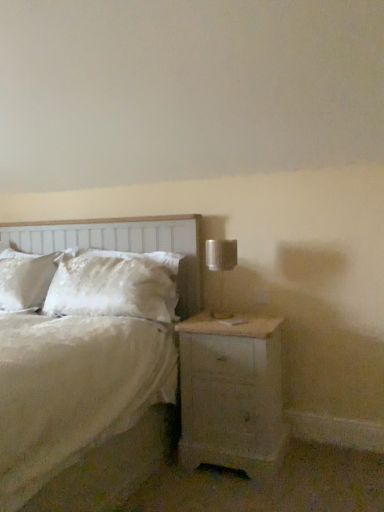
The image size is (384, 512). What do you see at coordinates (124, 243) in the screenshot? I see `white satin bed at center` at bounding box center [124, 243].

Looking at this image, measure the distance between metallic silver table lamp at right and camera.

The depth of metallic silver table lamp at right is 6.84 feet.

What is the approximate height of white wood headboard at left?

It is 84.37 centimeters.

Where is `white wood headboard at left`? white wood headboard at left is located at coordinates (124, 244).

Where is `white painted wood nightstand at lower right`? The height and width of the screenshot is (512, 384). white painted wood nightstand at lower right is located at coordinates (232, 394).

Can you tell me how much white painted wood nightstand at lower right and white satin bed at center differ in facing direction?

There is a 1.6-degree angle between the facing directions of white painted wood nightstand at lower right and white satin bed at center.

Does white painted wood nightstand at lower right turn towards white satin bed at center?

No, white painted wood nightstand at lower right is not oriented towards white satin bed at center.

Is white painted wood nightstand at lower right surrounding white satin bed at center?

No, white satin bed at center is not inside white painted wood nightstand at lower right.

From the image's perspective, which one is positioned higher, white painted wood nightstand at lower right or white satin bed at center?

white satin bed at center is shown above in the image.

Is white painted wood nightstand at lower right positioned before metallic silver table lamp at right?

Yes, it is in front of metallic silver table lamp at right.

In terms of width, does white painted wood nightstand at lower right look wider or thinner when compared to metallic silver table lamp at right?

white painted wood nightstand at lower right is wider than metallic silver table lamp at right.

Where is `table lamp that appears above the white painted wood nightstand at lower right (from the image's perspective)`? This screenshot has height=512, width=384. table lamp that appears above the white painted wood nightstand at lower right (from the image's perspective) is located at coordinates (221, 269).

Can you confirm if white painted wood nightstand at lower right is bigger than metallic silver table lamp at right?

Yes, white painted wood nightstand at lower right is bigger than metallic silver table lamp at right.

From the picture: Is white fluffy pillow at center next to white painted wood nightstand at lower right and touching it?

No, white fluffy pillow at center is not next to white painted wood nightstand at lower right.

Is white fluffy pillow at center positioned in front of white painted wood nightstand at lower right?

No, it is not.

Is white fluffy pillow at center facing away from white painted wood nightstand at lower right?

No.

From a real-world perspective, is white fluffy pillow at center under white painted wood nightstand at lower right?

Actually, white fluffy pillow at center is physically above white painted wood nightstand at lower right in the real world.

From their relative heights in the image, would you say metallic silver table lamp at right is taller or shorter than white painted wood nightstand at lower right?

Clearly, metallic silver table lamp at right is shorter compared to white painted wood nightstand at lower right.

Is metallic silver table lamp at right to the right of white painted wood nightstand at lower right from the viewer's perspective?

In fact, metallic silver table lamp at right is to the left of white painted wood nightstand at lower right.

From the image's perspective, who appears lower, metallic silver table lamp at right or white painted wood nightstand at lower right?

white painted wood nightstand at lower right appears lower in the image.

Considering the positions of objects white fluffy pillow at center and metallic silver table lamp at right in the image provided, who is more to the left, white fluffy pillow at center or metallic silver table lamp at right?

From the viewer's perspective, white fluffy pillow at center appears more on the left side.

Could you tell me if white fluffy pillow at center is facing metallic silver table lamp at right?

No, white fluffy pillow at center is not oriented towards metallic silver table lamp at right.

Can you tell me how much white fluffy pillow at center and metallic silver table lamp at right differ in facing direction?

1.27 degrees.

Image resolution: width=384 pixels, height=512 pixels. I want to click on pillow below the metallic silver table lamp at right (from the image's perspective), so click(x=114, y=285).

Considering the sizes of objects white wood headboard at left and metallic silver table lamp at right in the image provided, who is bigger, white wood headboard at left or metallic silver table lamp at right?

white wood headboard at left is bigger.

From their relative heights in the image, would you say white wood headboard at left is taller or shorter than metallic silver table lamp at right?

Considering their sizes, white wood headboard at left has more height than metallic silver table lamp at right.

From a real-world perspective, is white wood headboard at left physically above metallic silver table lamp at right?

No.

Between white painted wood nightstand at lower right and white wood headboard at left, which one has smaller size?

white painted wood nightstand at lower right.

Measure the distance from white painted wood nightstand at lower right to white wood headboard at left.

white painted wood nightstand at lower right and white wood headboard at left are 27.81 inches apart.

Is white painted wood nightstand at lower right located outside white wood headboard at left?

Yes, white painted wood nightstand at lower right is not within white wood headboard at left.

Is white painted wood nightstand at lower right touching white wood headboard at left?

No, white painted wood nightstand at lower right is not next to white wood headboard at left.

Locate an element on the screen. nightstand behind the white satin bed at center is located at coordinates (232, 394).

This screenshot has height=512, width=384. In order to click on nightstand on the right side of metallic silver table lamp at right in this screenshot , I will do `click(232, 394)`.

Looking at the image, which one is located further to metallic silver table lamp at right, white fluffy pillow at center or white painted wood nightstand at lower right?

white fluffy pillow at center lies further to metallic silver table lamp at right than the other object.

When comparing their distances from white wood headboard at left, does white fluffy pillow at center or white satin bed at center seem further?

white fluffy pillow at center is further to white wood headboard at left.

Estimate the real-world distances between objects in this image. Which object is closer to white wood headboard at left, metallic silver table lamp at right or white satin bed at center?

white satin bed at center is positioned closer to the anchor white wood headboard at left.

When comparing their distances from white satin bed at center, does white fluffy pillow at center or metallic silver table lamp at right seem closer?

Among the two, white fluffy pillow at center is located nearer to white satin bed at center.

When comparing their distances from white painted wood nightstand at lower right, does metallic silver table lamp at right or white wood headboard at left seem further?

white wood headboard at left is further to white painted wood nightstand at lower right.

Estimate the real-world distances between objects in this image. Which object is further from metallic silver table lamp at right, white painted wood nightstand at lower right or white wood headboard at left?

Based on the image, white wood headboard at left appears to be further to metallic silver table lamp at right.

From the image, which object appears to be nearer to white painted wood nightstand at lower right, white satin bed at center or white fluffy pillow at center?

Based on the image, white fluffy pillow at center appears to be nearer to white painted wood nightstand at lower right.

Considering their positions, is white fluffy pillow at center positioned closer to metallic silver table lamp at right than white wood headboard at left?

white fluffy pillow at center is positioned closer to the anchor metallic silver table lamp at right.

Find the location of a particular element. The image size is (384, 512). table lamp positioned between white satin bed at center and white fluffy pillow at center from near to far is located at coordinates (221, 269).

Where is `headboard positioned between white satin bed at center and white fluffy pillow at center from near to far`? headboard positioned between white satin bed at center and white fluffy pillow at center from near to far is located at coordinates (124, 244).

The height and width of the screenshot is (512, 384). What are the coordinates of `nightstand located between white satin bed at center and white fluffy pillow at center in the depth direction` in the screenshot? It's located at (232, 394).

This screenshot has height=512, width=384. Find the location of `table lamp between white fluffy pillow at center and white painted wood nightstand at lower right`. table lamp between white fluffy pillow at center and white painted wood nightstand at lower right is located at coordinates (221, 269).